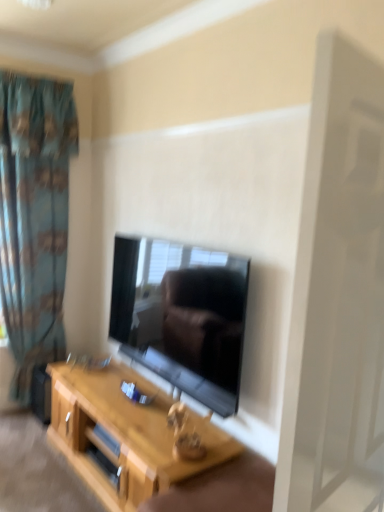
Describe the element at coordinates (124, 435) in the screenshot. I see `light wood table at center` at that location.

At what (x,y) coordinates should I click in order to perform the action: click on white matte screen door at upper right. Please return your answer as a coordinate pair (x, y). Looking at the image, I should click on pos(338,297).

Where is `screen door above the black glossy tv at center (from the image's perspective)`? The height and width of the screenshot is (512, 384). screen door above the black glossy tv at center (from the image's perspective) is located at coordinates (338, 297).

Is white matte screen door at upper right at the left side of black glossy tv at center?

No.

Consider the image. From a real-world perspective, is white matte screen door at upper right positioned above or below black glossy tv at center?

white matte screen door at upper right is above black glossy tv at center.

Is white matte screen door at upper right turned away from black glossy tv at center?

Yes.

This screenshot has width=384, height=512. Find the location of `curtain on the left of black glossy tv at center`. curtain on the left of black glossy tv at center is located at coordinates (34, 217).

Considering the positions of objects blue fabric curtain at left and black glossy tv at center in the image provided, who is more to the left, blue fabric curtain at left or black glossy tv at center?

Positioned to the left is blue fabric curtain at left.

Consider the image. Is blue fabric curtain at left positioned with its back to black glossy tv at center?

No, black glossy tv at center is not at the back of blue fabric curtain at left.

Does point (46, 170) lie behind point (224, 389)?

That is True.

Looking at this image, between black glossy tv at center and white matte screen door at upper right, which one has more height?

white matte screen door at upper right.

Is black glossy tv at center inside or outside of white matte screen door at upper right?

black glossy tv at center exists outside the volume of white matte screen door at upper right.

From the image's perspective, is black glossy tv at center positioned above or below white matte screen door at upper right?

black glossy tv at center is below white matte screen door at upper right.

Between black glossy tv at center and blue fabric curtain at left, which one has smaller size?

black glossy tv at center is smaller.

Is black glossy tv at center situated inside blue fabric curtain at left or outside?

black glossy tv at center is not inside blue fabric curtain at left, it's outside.

From the picture: Are black glossy tv at center and blue fabric curtain at left beside each other?

black glossy tv at center and blue fabric curtain at left are clearly separated.

Can you confirm if light wood table at center is shorter than white matte screen door at upper right?

Yes, light wood table at center is shorter than white matte screen door at upper right.

In the image, is light wood table at center on the left side or the right side of white matte screen door at upper right?

light wood table at center is to the left of white matte screen door at upper right.

Could you tell me if light wood table at center is turned towards white matte screen door at upper right?

No, light wood table at center is not facing towards white matte screen door at upper right.

Find the location of a particular element. table beneath the white matte screen door at upper right (from a real-world perspective) is located at coordinates (124, 435).

Visually, is blue fabric curtain at left positioned to the left or to the right of light wood table at center?

blue fabric curtain at left is positioned on light wood table at center's left side.

Measure the distance from blue fabric curtain at left to light wood table at center.

blue fabric curtain at left is 1.13 meters from light wood table at center.

Between blue fabric curtain at left and light wood table at center, which one has more height?

blue fabric curtain at left.

Is the depth of blue fabric curtain at left greater than that of light wood table at center?

Yes, it is behind light wood table at center.

From the image's perspective, is light wood table at center over blue fabric curtain at left?

No, from the image's perspective, light wood table at center is not on top of blue fabric curtain at left.

Is light wood table at center positioned behind blue fabric curtain at left?

No, it is in front of blue fabric curtain at left.

Which object is wider, light wood table at center or blue fabric curtain at left?

light wood table at center.

Is blue fabric curtain at left inside light wood table at center?

No, blue fabric curtain at left is not surrounded by light wood table at center.

Identify the location of screen door above the black glossy tv at center (from the image's perspective). (338, 297).

Locate an element on the screen. Image resolution: width=384 pixels, height=512 pixels. television that is on the right side of blue fabric curtain at left is located at coordinates (182, 316).

Estimate the real-world distances between objects in this image. Which object is closer to black glossy tv at center, blue fabric curtain at left or white matte screen door at upper right?

blue fabric curtain at left lies closer to black glossy tv at center than the other object.

From the image, which object appears to be farther from light wood table at center, white matte screen door at upper right or black glossy tv at center?

Among the two, white matte screen door at upper right is located further to light wood table at center.

Looking at the image, which one is located further to light wood table at center, white matte screen door at upper right or blue fabric curtain at left?

Based on the image, white matte screen door at upper right appears to be further to light wood table at center.

Based on their spatial positions, is light wood table at center or blue fabric curtain at left further from black glossy tv at center?

Among the two, blue fabric curtain at left is located further to black glossy tv at center.

Looking at the image, which one is located closer to white matte screen door at upper right, black glossy tv at center or light wood table at center?

Based on the image, black glossy tv at center appears to be nearer to white matte screen door at upper right.

Estimate the real-world distances between objects in this image. Which object is further from light wood table at center, blue fabric curtain at left or white matte screen door at upper right?

The object further to light wood table at center is white matte screen door at upper right.

Based on their spatial positions, is light wood table at center or black glossy tv at center further from blue fabric curtain at left?

light wood table at center is further to blue fabric curtain at left.

Looking at the image, which one is located further to blue fabric curtain at left, white matte screen door at upper right or black glossy tv at center?

white matte screen door at upper right lies further to blue fabric curtain at left than the other object.

You are a GUI agent. You are given a task and a screenshot of the screen. Output one action in this format:
    pyautogui.click(x=<x>, y=<y>)
    Task: Click on the table between white matte screen door at upper right and blue fabric curtain at left along the z-axis
    
    Given the screenshot: What is the action you would take?
    pyautogui.click(x=124, y=435)

Identify the location of television located between white matte screen door at upper right and blue fabric curtain at left in the depth direction. (182, 316).

Identify the location of television between blue fabric curtain at left and light wood table at center from top to bottom. (182, 316).

Where is `table between white matte screen door at upper right and black glossy tv at center along the z-axis`? This screenshot has height=512, width=384. table between white matte screen door at upper right and black glossy tv at center along the z-axis is located at coordinates (124, 435).